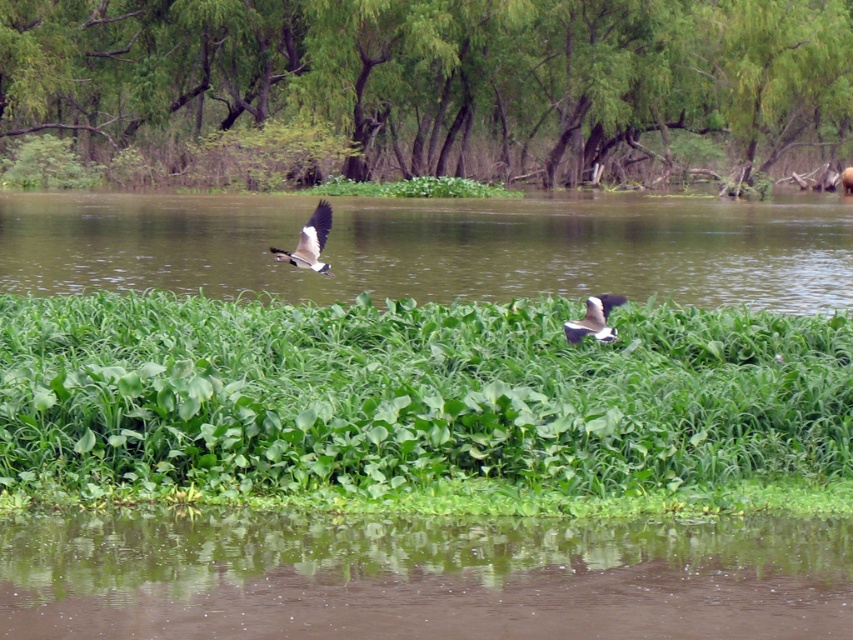
Question: Is green leafy grass at center below green leafy vegetation at center?

Choices:
 (A) yes
 (B) no

Answer: (A)

Question: Estimate the real-world distances between objects in this image. Which object is farther from the green leafy vegetation at center?

Choices:
 (A) brown reflective water at center
 (B) gray feathered bird at upper center

Answer: (A)

Question: Among these points, which one is nearest to the camera?

Choices:
 (A) (270, 396)
 (B) (357, 545)
 (C) (578, 77)

Answer: (B)

Question: Is green leafy grass at center further to the viewer compared to white glossy duck at center?

Choices:
 (A) yes
 (B) no

Answer: (A)

Question: Considering the relative positions of green leafy trees at upper center and brown reflective water at center in the image provided, where is green leafy trees at upper center located with respect to brown reflective water at center?

Choices:
 (A) below
 (B) above

Answer: (B)

Question: Which of the following is the closest to the observer?

Choices:
 (A) green leafy vegetation at center
 (B) green leafy grass at center
 (C) green leafy trees at upper center
 (D) brown reflective water at center

Answer: (D)